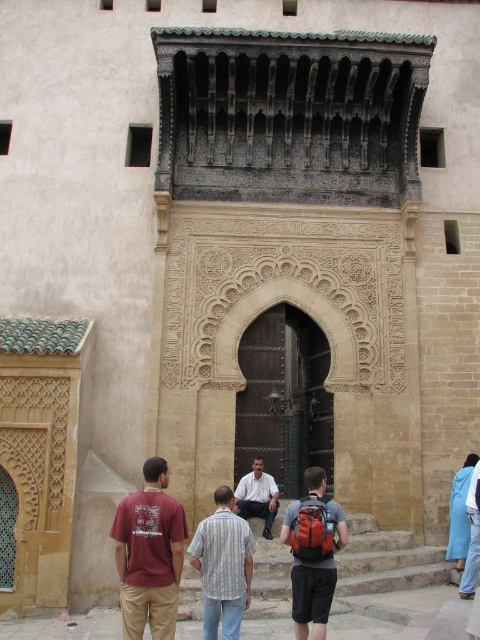
Which is in front, point (237, 600) or point (264, 508)?

Point (237, 600) is more forward.

How distant is striped cotton shirt at center from light brown leather pants at center?

5.20 meters

The height and width of the screenshot is (640, 480). What do you see at coordinates (223, 566) in the screenshot?
I see `striped cotton shirt at center` at bounding box center [223, 566].

Locate an element on the screen. striped cotton shirt at center is located at coordinates (223, 566).

Does orange fabric backpack at center have a larger size compared to dark wood door at center?

Correct, orange fabric backpack at center is larger in size than dark wood door at center.

Is point (287, 531) positioned behind point (276, 314)?

No, (287, 531) is closer to viewer.

You are a GUI agent. You are given a task and a screenshot of the screen. Output one action in this format:
    pyautogui.click(x=<x>, y=<y>)
    Task: Click on the orange fabric backpack at center
    This screenshot has height=640, width=480.
    Given the screenshot: What is the action you would take?
    pyautogui.click(x=312, y=554)

Does point (160, 515) come farther from viewer compared to point (457, 563)?

No, it is not.

Where is `maroon t-shirt at center`? maroon t-shirt at center is located at coordinates coord(149,554).

The height and width of the screenshot is (640, 480). Describe the element at coordinates (149, 554) in the screenshot. I see `maroon t-shirt at center` at that location.

Find the location of a particular element. maroon t-shirt at center is located at coordinates (149, 554).